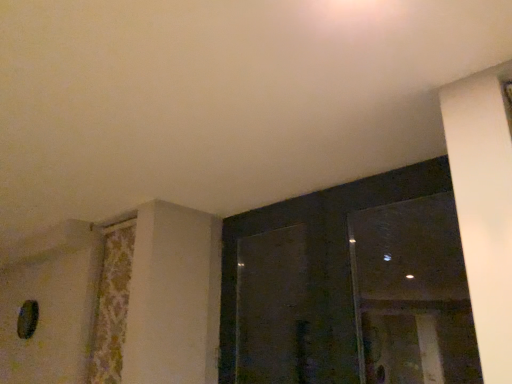
Question: Can you confirm if transparent glass screen door at center is thinner than transparent glass window at upper right, arranged as the second window when viewed from the right?

Choices:
 (A) no
 (B) yes

Answer: (A)

Question: From a real-world perspective, is transparent glass screen door at center below transparent glass window at upper right, arranged as the second window when viewed from the right?

Choices:
 (A) no
 (B) yes

Answer: (B)

Question: Is transparent glass screen door at center with transparent glass window at upper right, arranged as the second window when viewed from the right?

Choices:
 (A) yes
 (B) no

Answer: (B)

Question: Is transparent glass screen door at center not within transparent glass window at upper right, arranged as the second window when viewed from the right?

Choices:
 (A) yes
 (B) no

Answer: (B)

Question: Considering the relative sizes of transparent glass screen door at center and transparent glass window at upper right, arranged as the second window when viewed from the right, in the image provided, is transparent glass screen door at center taller than transparent glass window at upper right, arranged as the second window when viewed from the right,?

Choices:
 (A) yes
 (B) no

Answer: (B)

Question: Is transparent glass screen door at center to the left or to the right of floral fabric curtain at left in the image?

Choices:
 (A) left
 (B) right

Answer: (B)

Question: From a real-world perspective, is transparent glass screen door at center physically located above or below floral fabric curtain at left?

Choices:
 (A) above
 (B) below

Answer: (A)

Question: Is transparent glass screen door at center spatially inside floral fabric curtain at left, or outside of it?

Choices:
 (A) inside
 (B) outside

Answer: (B)

Question: Is transparent glass screen door at center bigger or smaller than floral fabric curtain at left?

Choices:
 (A) small
 (B) big

Answer: (B)

Question: Based on their positions, is floral fabric curtain at left located to the left or right of transparent glass screen door at center?

Choices:
 (A) right
 (B) left

Answer: (B)

Question: Does point (124, 334) appear closer or farther from the camera than point (270, 311)?

Choices:
 (A) closer
 (B) farther

Answer: (A)

Question: From a real-world perspective, relative to transparent glass screen door at center, is floral fabric curtain at left vertically above or below?

Choices:
 (A) above
 (B) below

Answer: (B)

Question: Choose the correct answer: Is floral fabric curtain at left inside transparent glass screen door at center or outside it?

Choices:
 (A) outside
 (B) inside

Answer: (A)

Question: Considering the positions of transparent glass screen door at center and transparent glass window at upper right, acting as the first window starting from the left, in the image, is transparent glass screen door at center bigger or smaller than transparent glass window at upper right, acting as the first window starting from the left,?

Choices:
 (A) small
 (B) big

Answer: (A)

Question: Is transparent glass screen door at center in front of or behind transparent glass window at upper right, arranged as the second window when viewed from the right, in the image?

Choices:
 (A) front
 (B) behind

Answer: (B)